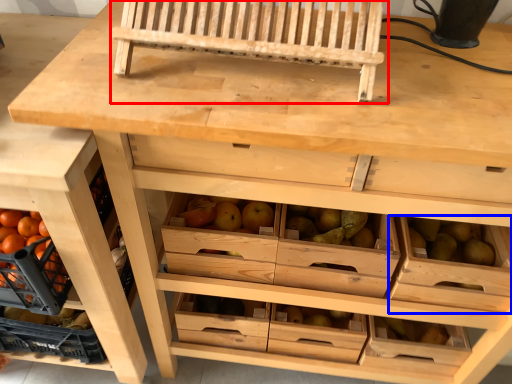
Question: Which object is further to the camera taking this photo, church bench (highlighted by a red box) or drawer (highlighted by a blue box)?

Choices:
 (A) church bench
 (B) drawer

Answer: (B)